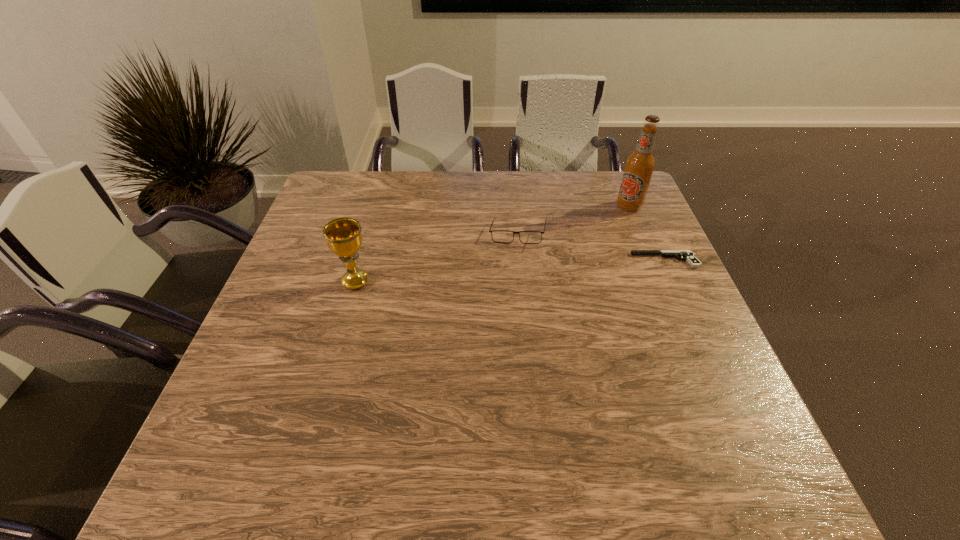
Where is `pistol that is at the right edge`? pistol that is at the right edge is located at coordinates (688, 255).

The height and width of the screenshot is (540, 960). I want to click on beer bottle that is at the right edge, so click(x=639, y=166).

Find the location of a particular element. The height and width of the screenshot is (540, 960). object positioned at the far right corner is located at coordinates (639, 166).

Where is `free space at the far edge`? This screenshot has height=540, width=960. free space at the far edge is located at coordinates (422, 184).

This screenshot has width=960, height=540. In the image, there is a desktop. Find the location of `vacant space at the left edge`. vacant space at the left edge is located at coordinates click(x=279, y=314).

The height and width of the screenshot is (540, 960). What are the coordinates of `vacant space at the right edge` in the screenshot? It's located at (701, 387).

Locate an element on the screen. The image size is (960, 540). vacant space at the far left corner of the desktop is located at coordinates (333, 176).

Where is `free space between the beer bottle and the shortest object`? The image size is (960, 540). free space between the beer bottle and the shortest object is located at coordinates (647, 233).

Identify the location of free space between the third tallest object and the farthest object. coord(573,220).

Find the location of `blank region between the second tallest object and the tallest object`. blank region between the second tallest object and the tallest object is located at coordinates (492, 244).